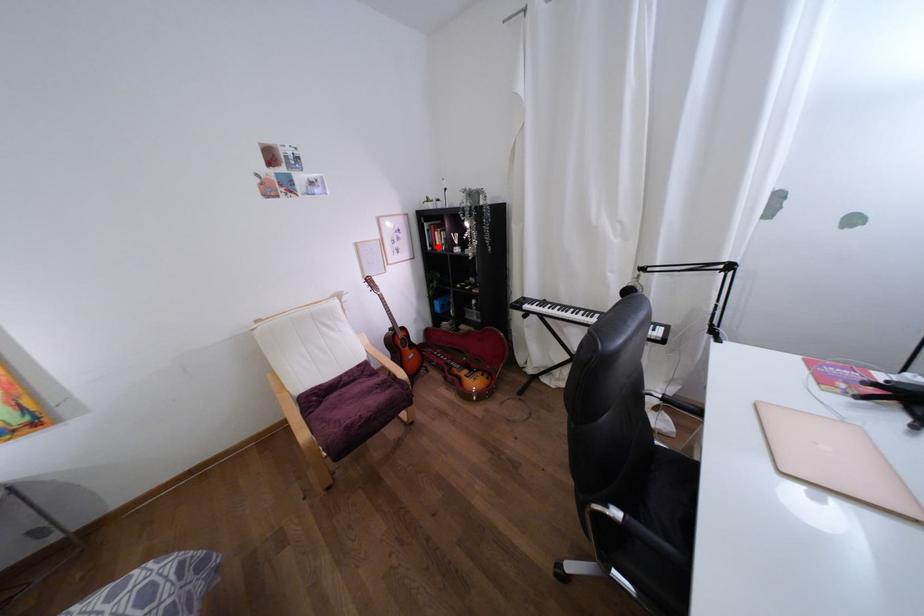
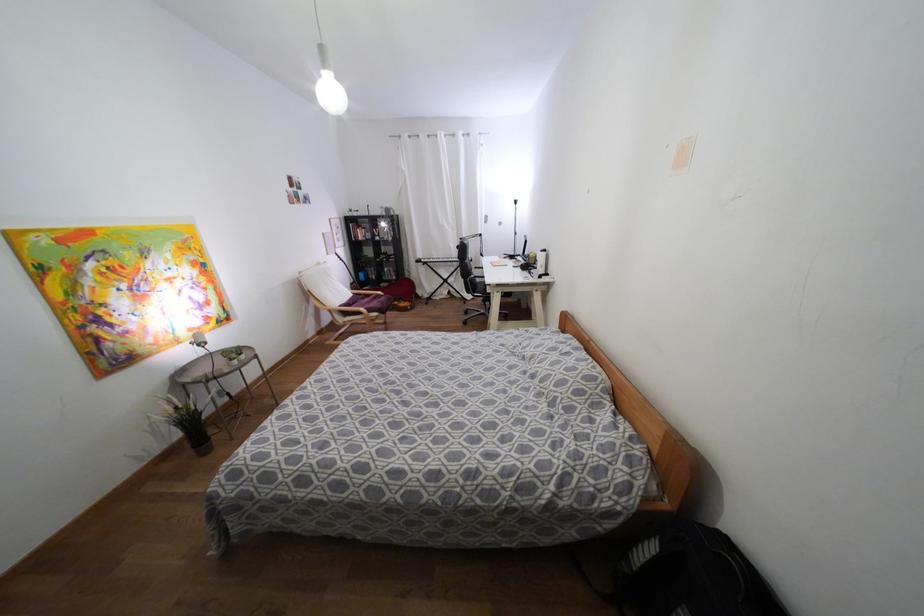
In the second image, find the point that corresponds to the highlighted location in the first image.

(359, 238)